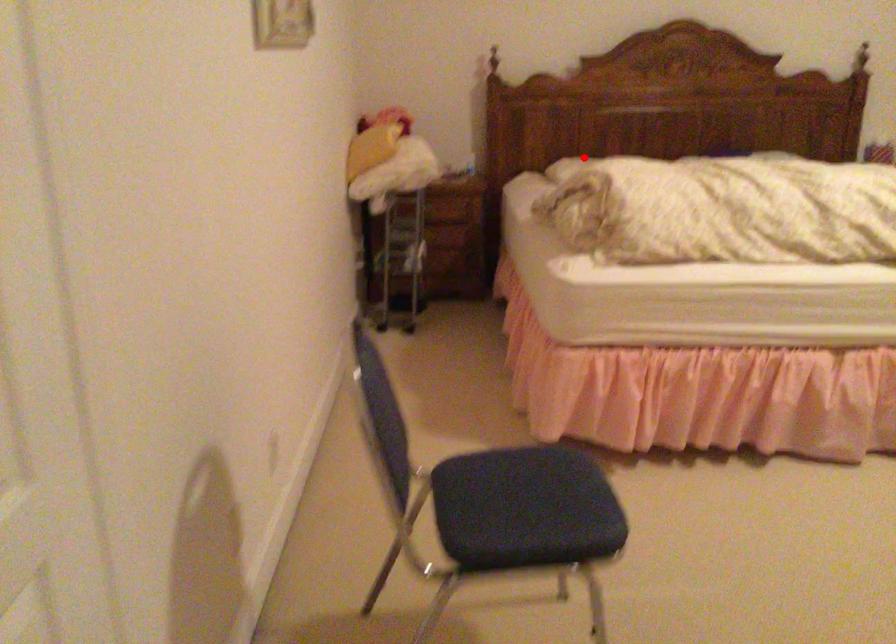
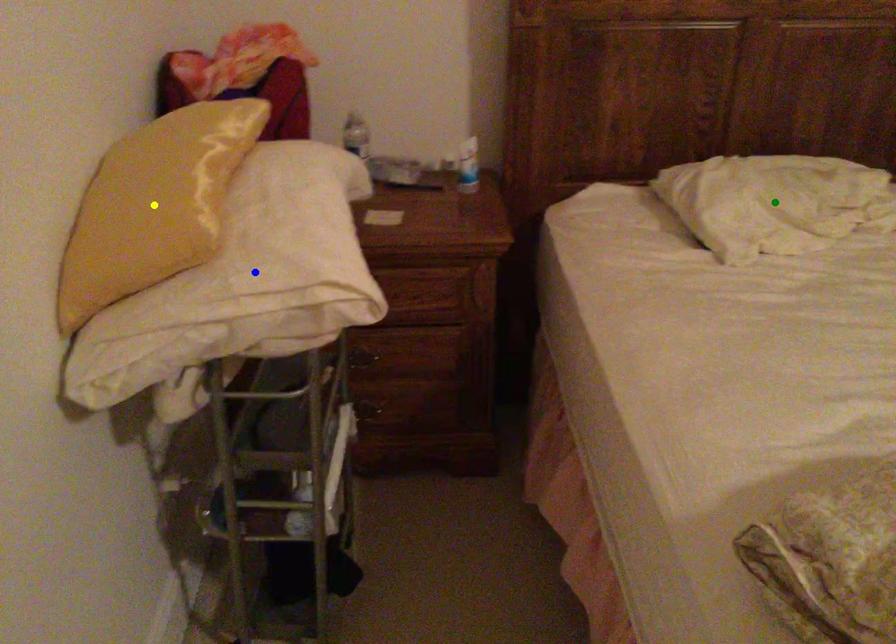
Question: I am providing you with two images of the same scene from different viewpoints. A red point is marked on the first image. You are given multiple points on the second image. Which point in image 2 is actually the same real-world point as the red point in image 1?

Choices:
 (A) blue point
 (B) green point
 (C) yellow point

Answer: (B)